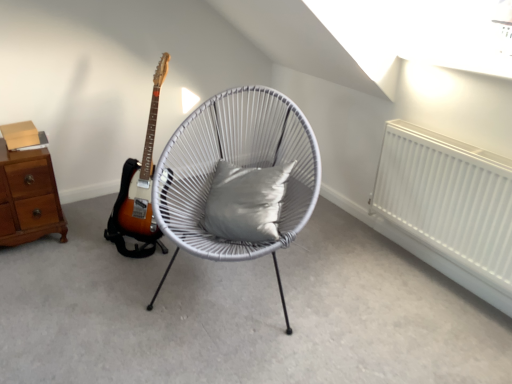
What is the approximate width of white woven chair at center?

white woven chair at center is 31.44 inches in width.

Where is `white woven chair at center`? white woven chair at center is located at coordinates (238, 165).

Where is `white matte radiator at right`? white matte radiator at right is located at coordinates (449, 206).

Is white matte radiator at right aimed at gray fabric pillow at center?

Yes, white matte radiator at right faces towards gray fabric pillow at center.

From their relative heights in the image, would you say white matte radiator at right is taller or shorter than gray fabric pillow at center?

In the image, white matte radiator at right appears to be taller than gray fabric pillow at center.

The width and height of the screenshot is (512, 384). What are the coordinates of `radiator below the gray fabric pillow at center (from the image's perspective)` in the screenshot? It's located at (449, 206).

From a real-world perspective, between brown wood chest of drawers at left and gray fabric pillow at center, who is vertically lower?

In real-world perspective, brown wood chest of drawers at left is lower.

Can you confirm if brown wood chest of drawers at left is positioned to the left of gray fabric pillow at center?

Yes.

In the scene shown: Is brown wood chest of drawers at left with gray fabric pillow at center?

No, brown wood chest of drawers at left is not touching gray fabric pillow at center.

Can you confirm if white matte radiator at right is bigger than brown wood chest of drawers at left?

No.

Find the location of a particular element. The width and height of the screenshot is (512, 384). the chest of drawers below the white matte radiator at right (from a real-world perspective) is located at coordinates (28, 197).

Consider the image. Between white matte radiator at right and brown wood chest of drawers at left, which one is positioned behind?

brown wood chest of drawers at left is more distant.

In the scene shown: Is white matte radiator at right completely or partially outside of brown wood chest of drawers at left?

Yes, white matte radiator at right is located beyond the bounds of brown wood chest of drawers at left.

Is gray fabric pillow at center facing away from brown wood chest of drawers at left?

No.

Visually, is gray fabric pillow at center positioned to the left or to the right of brown wood chest of drawers at left?

gray fabric pillow at center is to the right of brown wood chest of drawers at left.

Which of these two, gray fabric pillow at center or brown wood chest of drawers at left, is bigger?

brown wood chest of drawers at left.

Is gray fabric pillow at center thinner than brown wood chest of drawers at left?

Correct, the width of gray fabric pillow at center is less than that of brown wood chest of drawers at left.

How many degrees apart are the facing directions of brown wood chest of drawers at left and white woven chair at center?

The angular difference between brown wood chest of drawers at left and white woven chair at center is 40.6 degrees.

Is white woven chair at center at the back of brown wood chest of drawers at left?

No, brown wood chest of drawers at left is not facing the opposite direction of white woven chair at center.

Considering the positions of objects brown wood chest of drawers at left and white woven chair at center in the image provided, who is behind, brown wood chest of drawers at left or white woven chair at center?

Positioned behind is brown wood chest of drawers at left.

Between brown wood chest of drawers at left and white woven chair at center, which one has less height?

brown wood chest of drawers at left.

Which of these two, white woven chair at center or brown wood chest of drawers at left, stands shorter?

Standing shorter between the two is brown wood chest of drawers at left.

Does point (242, 158) lie in front of point (42, 212)?

Yes, it is in front of point (42, 212).

Is white woven chair at center far away from brown wood chest of drawers at left?

No.

Is white woven chair at center wider or thinner than brown wood chest of drawers at left?

white woven chair at center is wider than brown wood chest of drawers at left.

Which point is more distant from viewer, (313,179) or (487,219)?

Positioned behind is point (313,179).

Could you tell me if white woven chair at center is turned towards white matte radiator at right?

No, white woven chair at center is not turned towards white matte radiator at right.

Locate an element on the screen. Image resolution: width=512 pixels, height=384 pixels. chair located above the white matte radiator at right (from a real-world perspective) is located at coordinates (238, 165).

Which is correct: white woven chair at center is inside white matte radiator at right, or outside of it?

white woven chair at center is located beyond the bounds of white matte radiator at right.

This screenshot has width=512, height=384. Identify the location of radiator on the right side of gray fabric pillow at center. (449, 206).

Where is `pillow that appears below the brown wood chest of drawers at left (from the image's perspective)`? Image resolution: width=512 pixels, height=384 pixels. pillow that appears below the brown wood chest of drawers at left (from the image's perspective) is located at coordinates (246, 202).

Which object lies further to the anchor point white woven chair at center, gray fabric pillow at center or white matte radiator at right?

The object further to white woven chair at center is white matte radiator at right.

Estimate the real-world distances between objects in this image. Which object is further from gray fabric pillow at center, white matte radiator at right or white woven chair at center?

Among the two, white matte radiator at right is located further to gray fabric pillow at center.

Looking at the image, which one is located closer to white woven chair at center, gray fabric pillow at center or brown wood chest of drawers at left?

Among the two, gray fabric pillow at center is located nearer to white woven chair at center.

In the scene shown: Based on their spatial positions, is gray fabric pillow at center or white matte radiator at right further from brown wood chest of drawers at left?

The object further to brown wood chest of drawers at left is white matte radiator at right.

Considering their positions, is brown wood chest of drawers at left positioned further to white matte radiator at right than white woven chair at center?

brown wood chest of drawers at left is further to white matte radiator at right.

Based on their spatial positions, is gray fabric pillow at center or brown wood chest of drawers at left further from white matte radiator at right?

The object further to white matte radiator at right is brown wood chest of drawers at left.

Which object lies further to the anchor point gray fabric pillow at center, brown wood chest of drawers at left or white matte radiator at right?

brown wood chest of drawers at left lies further to gray fabric pillow at center than the other object.

Based on the photo, which object lies further to the anchor point brown wood chest of drawers at left, white woven chair at center or white matte radiator at right?

white matte radiator at right is further to brown wood chest of drawers at left.

Find the location of a particular element. The width and height of the screenshot is (512, 384). pillow located between white woven chair at center and white matte radiator at right in the left-right direction is located at coordinates (246, 202).

Where is `pillow between brown wood chest of drawers at left and white matte radiator at right`? This screenshot has width=512, height=384. pillow between brown wood chest of drawers at left and white matte radiator at right is located at coordinates (246, 202).

In order to click on chair situated between brown wood chest of drawers at left and gray fabric pillow at center from left to right in this screenshot , I will do `click(238, 165)`.

Identify the location of chair located between brown wood chest of drawers at left and white matte radiator at right in the left-right direction. The height and width of the screenshot is (384, 512). (238, 165).